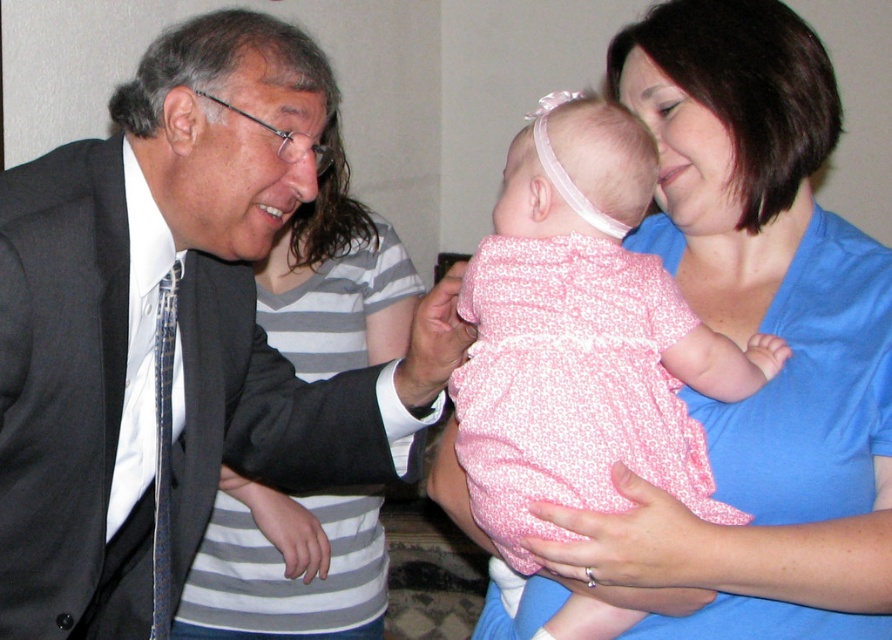
Question: Which point appears closest to the camera in this image?

Choices:
 (A) (296, 243)
 (B) (323, 113)
 (C) (492, 432)
 (D) (105, 534)

Answer: (C)

Question: From the image, what is the correct spatial relationship of matte black suit at center in relation to matte black suit at left?

Choices:
 (A) left
 (B) right

Answer: (A)

Question: Can you confirm if white satin shirt at left is positioned to the right of blue textured tie at left?

Choices:
 (A) yes
 (B) no

Answer: (B)

Question: Considering the real-world distances, which object is closest to the pink floral dress at center?

Choices:
 (A) matte black suit at center
 (B) white satin shirt at left
 (C) blue textured tie at left

Answer: (A)

Question: Is matte black suit at center in front of matte black suit at left?

Choices:
 (A) no
 (B) yes

Answer: (B)

Question: Which object is positioned closest to the white satin shirt at left?

Choices:
 (A) matte black suit at center
 (B) pink floral dress at center
 (C) matte black suit at left
 (D) blue textured tie at left

Answer: (D)